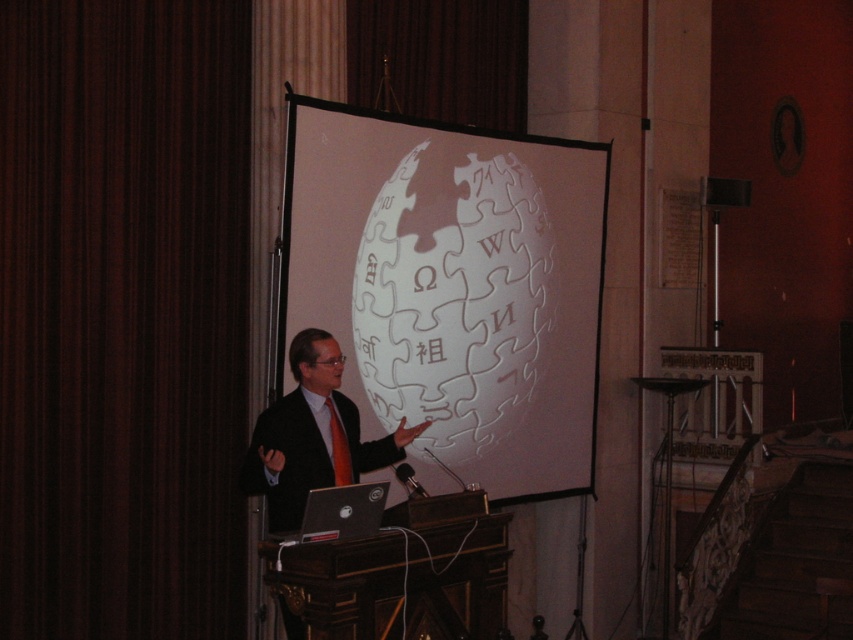
Question: Among these points, which one is farthest from the camera?

Choices:
 (A) (305, 484)
 (B) (502, 168)
 (C) (175, 445)

Answer: (B)

Question: Is dark brown fabric at left smaller than white matte projection screen at center?

Choices:
 (A) no
 (B) yes

Answer: (B)

Question: In this image, where is white matte projection screen at center located relative to matte black suit at center?

Choices:
 (A) above
 (B) below

Answer: (A)

Question: Which object is farther from the camera taking this photo?

Choices:
 (A) dark brown fabric at left
 (B) white matte projection screen at center
 (C) matte black suit at center

Answer: (B)

Question: Does white matte projection screen at center appear under matte black suit at center?

Choices:
 (A) yes
 (B) no

Answer: (B)

Question: Among these points, which one is farthest from the camera?

Choices:
 (A) (180, 208)
 (B) (265, 413)

Answer: (A)